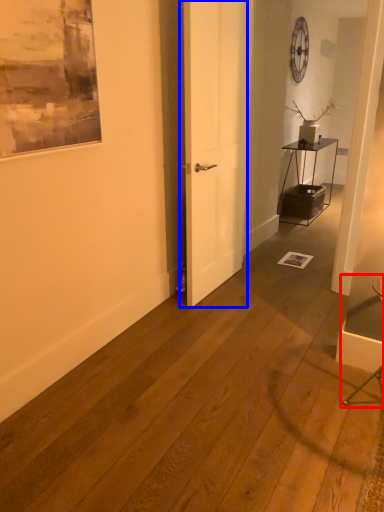
Question: Which point is further to the camera, armchair (highlighted by a red box) or door (highlighted by a blue box)?

Choices:
 (A) armchair
 (B) door

Answer: (B)